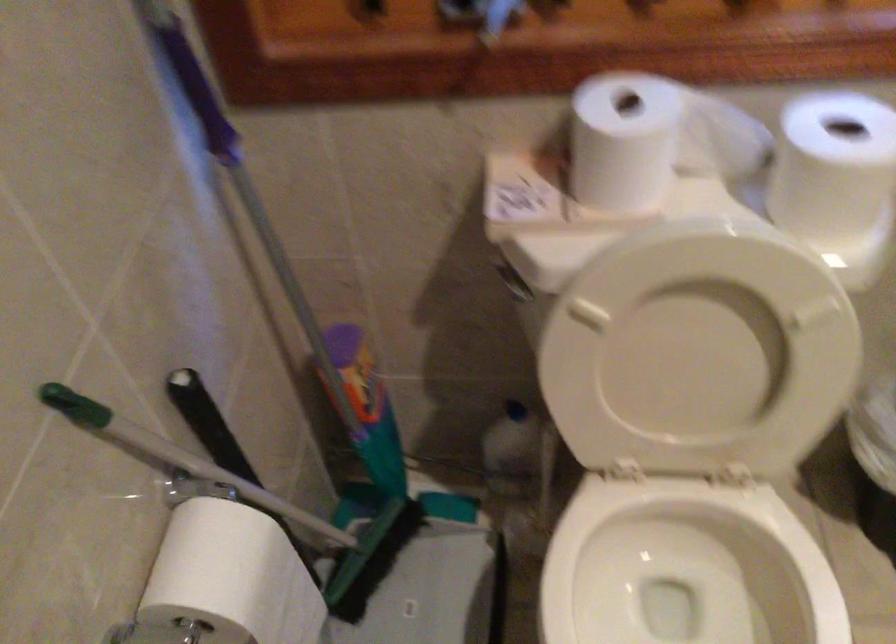
Which object does [424,576] point to?

It corresponds to the small cardboard box in the image.